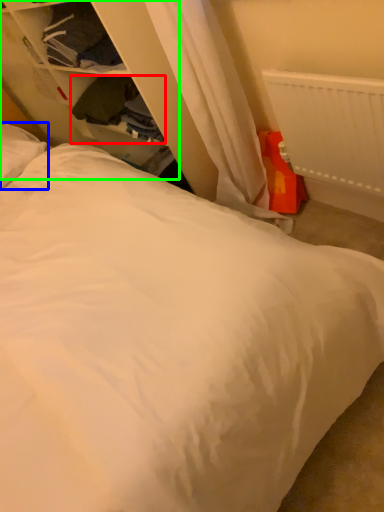
Question: Which is farther away from clothing (highlighted by a red box)? pillow (highlighted by a blue box) or dresser (highlighted by a green box)?

Choices:
 (A) pillow
 (B) dresser

Answer: (A)